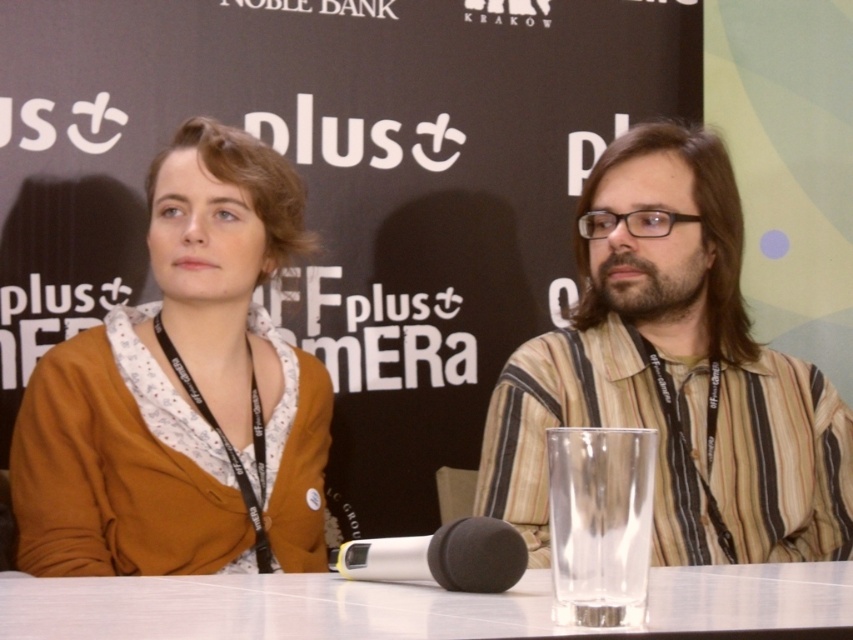
Is matte black banner at center bigger than striped cotton shirt at center?

Yes, matte black banner at center is bigger than striped cotton shirt at center.

Does point (178, 70) lie in front of point (677, 186)?

No, (178, 70) is further to viewer.

Which is in front, point (134, 156) or point (630, 362)?

Point (630, 362)

Where is `matte black banner at center`? matte black banner at center is located at coordinates (335, 188).

Between point (640, 72) and point (268, 614), which one is positioned behind?

The point (640, 72) is more distant.

Between matte black banner at center and clear glass table at center, which one appears on the left side from the viewer's perspective?

matte black banner at center is more to the left.

Who is more forward, (393, 35) or (509, 618)?

Point (509, 618) is more forward.

Where is `matte black banner at center`? The width and height of the screenshot is (853, 640). matte black banner at center is located at coordinates (335, 188).

Locate an element on the screen. The height and width of the screenshot is (640, 853). matte brown cardigan at center is located at coordinates (183, 392).

Identify the location of matte brown cardigan at center. (183, 392).

Locate an element on the screen. The image size is (853, 640). matte brown cardigan at center is located at coordinates (183, 392).